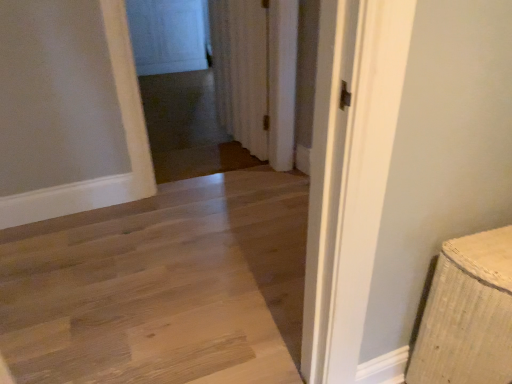
What do you see at coordinates (165, 289) in the screenshot? The width and height of the screenshot is (512, 384). I see `natural wood floor at center` at bounding box center [165, 289].

The height and width of the screenshot is (384, 512). I want to click on white textured curtain at center, so click(257, 74).

You are a GUI agent. You are given a task and a screenshot of the screen. Output one action in this format:
    pyautogui.click(x=<x>, y=<y>)
    Task: Click on the natural wood floor at center
    Image resolution: width=512 pixels, height=384 pixels.
    Given the screenshot: What is the action you would take?
    pyautogui.click(x=165, y=289)

Is transparent glass screen door at upper center closer to the viewer compared to natural wood floor at center?

No.

Does transparent glass screen door at upper center appear on the left side of natural wood floor at center?

Correct, you'll find transparent glass screen door at upper center to the left of natural wood floor at center.

From a real-world perspective, is transparent glass screen door at upper center on natural wood floor at center?

Yes, from a real-world perspective, transparent glass screen door at upper center is above natural wood floor at center.

Which is behind, point (199, 16) or point (106, 332)?

The point (199, 16) is farther from the camera.

From the image's perspective, who appears lower, natural wood floor at center or transparent glass screen door at upper center?

natural wood floor at center is shown below in the image.

Which of these two, natural wood floor at center or transparent glass screen door at upper center, is thinner?

transparent glass screen door at upper center is thinner.

Between natural wood floor at center and transparent glass screen door at upper center, which one appears on the right side from the viewer's perspective?

natural wood floor at center.

How many degrees apart are the facing directions of natural wood floor at center and transparent glass screen door at upper center?

2.4 degrees separate the facing orientations of natural wood floor at center and transparent glass screen door at upper center.

Is white textured curtain at center positioned beyond the bounds of transparent glass screen door at upper center?

Yes, white textured curtain at center is located beyond the bounds of transparent glass screen door at upper center.

Who is bigger, white textured curtain at center or transparent glass screen door at upper center?

white textured curtain at center.

Is white textured curtain at center facing away from transparent glass screen door at upper center?

That's not correct — white textured curtain at center is not looking away from transparent glass screen door at upper center.

Between transparent glass screen door at upper center and white textured curtain at center, which one has larger size?

Bigger between the two is white textured curtain at center.

Looking at this image, choose the correct answer: Is transparent glass screen door at upper center inside white textured curtain at center or outside it?

transparent glass screen door at upper center is located beyond the bounds of white textured curtain at center.

Is white textured curtain at center at the back of transparent glass screen door at upper center?

transparent glass screen door at upper center is not turned away from white textured curtain at center.

Is the depth of natural wood floor at center greater than that of white textured curtain at center?

No, natural wood floor at center is in front of white textured curtain at center.

Considering the positions of points (74, 237) and (278, 66), is point (74, 237) farther from camera compared to point (278, 66)?

No, it is in front of (278, 66).

Looking at their sizes, would you say natural wood floor at center is wider or thinner than white textured curtain at center?

natural wood floor at center is wider than white textured curtain at center.

Consider the image. Considering the relative sizes of natural wood floor at center and white textured curtain at center in the image provided, is natural wood floor at center shorter than white textured curtain at center?

Indeed, natural wood floor at center has a lesser height compared to white textured curtain at center.

From the image's perspective, which is below, white textured curtain at center or natural wood floor at center?

natural wood floor at center is shown below in the image.

From the picture: Between white textured curtain at center and natural wood floor at center, which one has smaller width?

With smaller width is white textured curtain at center.

Image resolution: width=512 pixels, height=384 pixels. Identify the location of curtain above the natural wood floor at center (from a real-world perspective). (257, 74).

I want to click on screen door above the natural wood floor at center (from the image's perspective), so click(167, 35).

Image resolution: width=512 pixels, height=384 pixels. I want to click on screen door behind the natural wood floor at center, so click(x=167, y=35).

Looking at the image, which one is located further to natural wood floor at center, transparent glass screen door at upper center or white textured curtain at center?

transparent glass screen door at upper center lies further to natural wood floor at center than the other object.

From the image, which object appears to be nearer to white textured curtain at center, natural wood floor at center or transparent glass screen door at upper center?

natural wood floor at center.

From the picture: Considering their positions, is white textured curtain at center positioned closer to transparent glass screen door at upper center than natural wood floor at center?

white textured curtain at center.

Which object lies further to the anchor point transparent glass screen door at upper center, natural wood floor at center or white textured curtain at center?

natural wood floor at center is further to transparent glass screen door at upper center.

Based on the photo, based on their spatial positions, is transparent glass screen door at upper center or natural wood floor at center further from white textured curtain at center?

transparent glass screen door at upper center.

When comparing their distances from natural wood floor at center, does white textured curtain at center or transparent glass screen door at upper center seem closer?

The object closer to natural wood floor at center is white textured curtain at center.

Find the location of `curtain located between natural wood floor at center and transparent glass screen door at upper center in the depth direction`. curtain located between natural wood floor at center and transparent glass screen door at upper center in the depth direction is located at coordinates (257, 74).